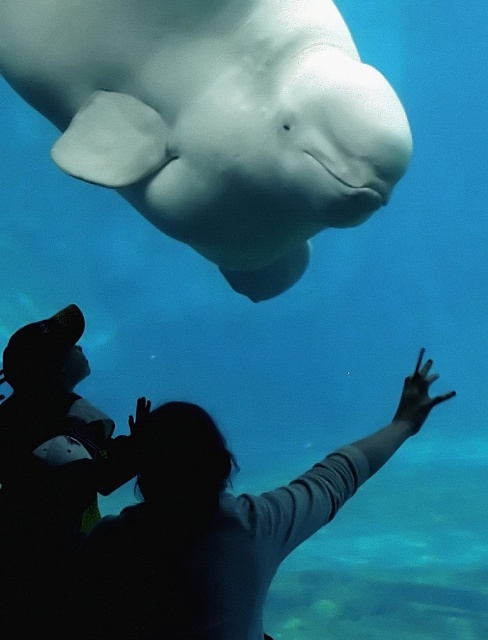
Question: Is white smooth whale at upper center wider than silhouette fabric at center?

Choices:
 (A) yes
 (B) no

Answer: (A)

Question: Is white smooth whale at upper center closer to the viewer compared to silhouette fabric at center?

Choices:
 (A) yes
 (B) no

Answer: (B)

Question: Is white smooth whale at upper center bigger than silhouette fabric at center?

Choices:
 (A) no
 (B) yes

Answer: (B)

Question: Among these points, which one is farthest from the camera?

Choices:
 (A) (345, 86)
 (B) (371, 436)

Answer: (A)